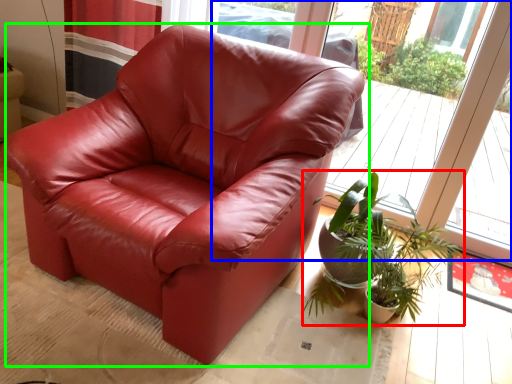
Question: Estimate the real-world distances between objects in this image. Which object is closer to houseplant (highlighted by a red box), window (highlighted by a blue box) or chair (highlighted by a green box)?

Choices:
 (A) window
 (B) chair

Answer: (B)